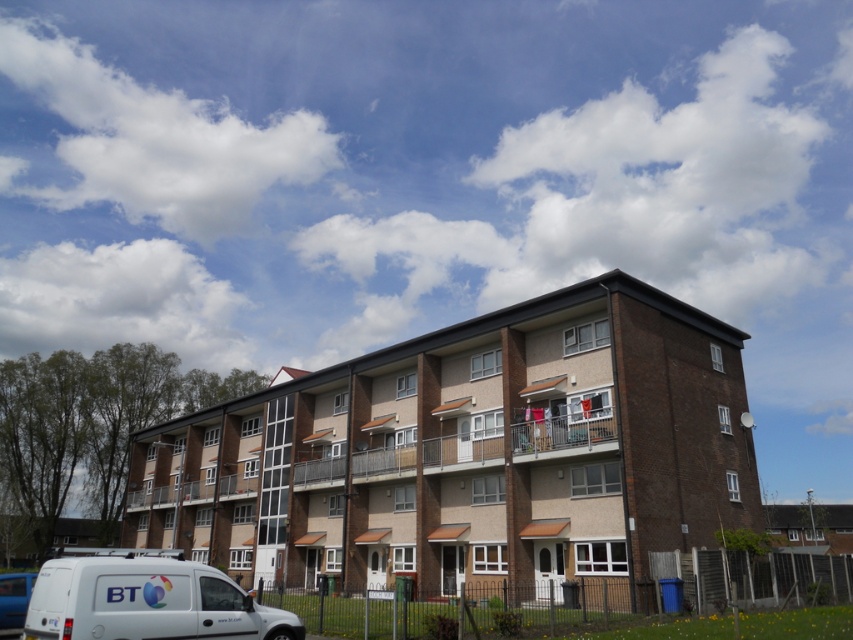
Between point (242, 636) and point (3, 596), which one is positioned in front?

Positioned in front is point (242, 636).

Is point (35, 620) positioned after point (6, 588)?

No, it is in front of (6, 588).

The image size is (853, 640). Identify the location of white matte van at lower left. (146, 600).